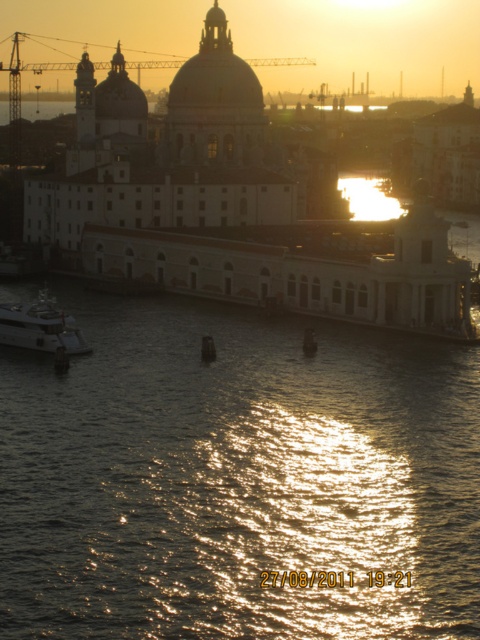
You are a tourist standing at the edge of the canal in Venice. You want to take a photo of the Basilica di Santa Maria della Salute with its reflection in the water. Where should you position yourself to capture the reflection of the basilica in the shiny reflective water at lower center?

The shiny reflective water at lower center is located at point (x=236, y=477), so you should position yourself near that coordinate to capture the reflection of the Basilica di Santa Maria della Salute in the water.

You are standing on the canal bank and want to take a photo of the shiny reflective water at lower center and the shiny silver yacht at lower left. Which object will appear larger in your photo?

The shiny reflective water at lower center will appear larger in the photo because it is closer to the viewer than the shiny silver yacht at lower left.

You are a tourist in Venice and want to take a photo of the shiny reflective water at lower center and the shiny silver yacht at lower left. Which object appears larger in the photo?

The shiny reflective water at lower center appears larger in the photo because it is much taller than the shiny silver yacht at lower left according to the description.